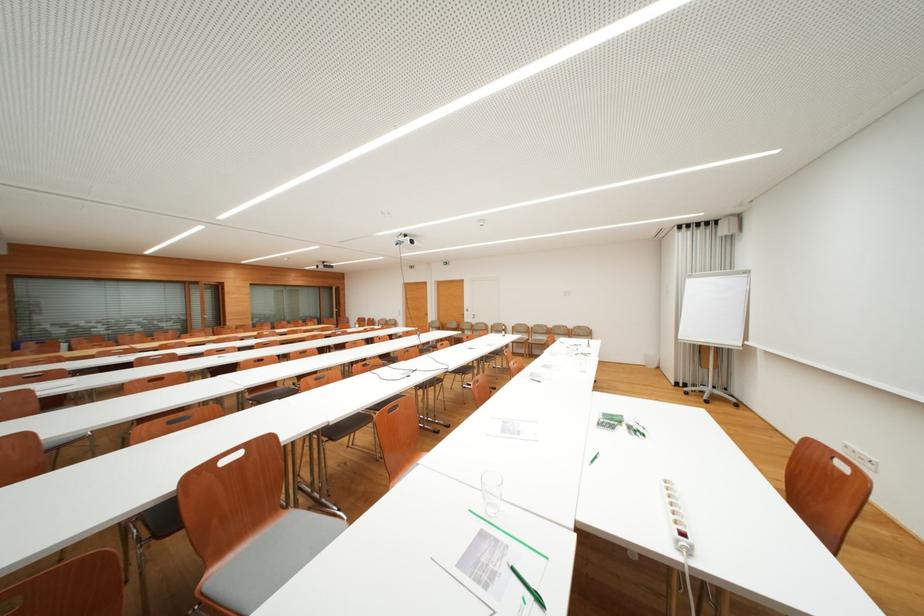
Describe the element at coordinates (525, 583) in the screenshot. I see `the green pen` at that location.